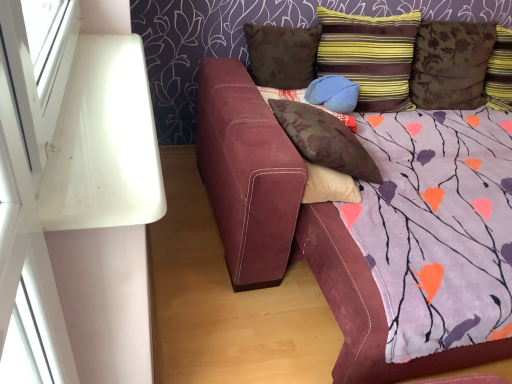
The width and height of the screenshot is (512, 384). Identify the location of striped velvet pillow at upper right, marked as the 4th pillow in a left-to-right arrangement. (370, 56).

At what (x,y) coordinates should I click in order to perform the action: click on suede couch at center. Please return your answer as a coordinate pair (x, y). Looking at the image, I should click on (295, 227).

Describe the element at coordinates (324, 140) in the screenshot. I see `brown suede pillow at center, acting as the fourth pillow starting from the right` at that location.

At what (x,y) coordinates should I click in order to perform the action: click on striped velvet pillow at upper right, placed as the 2th pillow when sorted from right to left. Please return your answer as a coordinate pair (x, y). Image resolution: width=512 pixels, height=384 pixels. Looking at the image, I should click on (370, 56).

Who is shorter, brown suede pillow at center, which ranks as the second pillow in left-to-right order, or striped velvet pillow at upper right, marked as the 4th pillow in a left-to-right arrangement?

With less height is brown suede pillow at center, which ranks as the second pillow in left-to-right order.

Which object is wider, brown suede pillow at center, which ranks as the second pillow in left-to-right order, or striped velvet pillow at upper right, marked as the 4th pillow in a left-to-right arrangement?

brown suede pillow at center, which ranks as the second pillow in left-to-right order.

Would you consider brown suede pillow at center, acting as the fourth pillow starting from the right, to be distant from striped velvet pillow at upper right, placed as the 2th pillow when sorted from right to left?

brown suede pillow at center, acting as the fourth pillow starting from the right, is near striped velvet pillow at upper right, placed as the 2th pillow when sorted from right to left, not far away.

From the image's perspective, relative to striped velvet pillow at upper right, placed as the 2th pillow when sorted from right to left, is brown suede pillow at center, acting as the fourth pillow starting from the right, above or below?

brown suede pillow at center, acting as the fourth pillow starting from the right, is below striped velvet pillow at upper right, placed as the 2th pillow when sorted from right to left.

I want to click on the 2nd pillow behind the brown suede pillow at center, which ranks as the second pillow in left-to-right order, so click(x=333, y=93).

Does blue suede pillow at upper center, which ranks as the third pillow in left-to-right order, have a greater width compared to brown suede pillow at center, acting as the fourth pillow starting from the right?

Incorrect, the width of blue suede pillow at upper center, which ranks as the third pillow in left-to-right order, does not surpass that of brown suede pillow at center, acting as the fourth pillow starting from the right.

Measure the distance from blue suede pillow at upper center, which ranks as the 3th pillow in right-to-left order, to brown suede pillow at center, acting as the fourth pillow starting from the right.

blue suede pillow at upper center, which ranks as the 3th pillow in right-to-left order, and brown suede pillow at center, acting as the fourth pillow starting from the right, are 16.33 inches apart.

What's the angular difference between blue suede pillow at upper center, which ranks as the 3th pillow in right-to-left order, and brown suede pillow at center, acting as the fourth pillow starting from the right,'s facing directions?

The facing directions of blue suede pillow at upper center, which ranks as the 3th pillow in right-to-left order, and brown suede pillow at center, acting as the fourth pillow starting from the right, are 0.000286 degrees apart.

Is suede couch at center in contact with brown suede pillow at center, which ranks as the second pillow in left-to-right order?

No, suede couch at center is not next to brown suede pillow at center, which ranks as the second pillow in left-to-right order.

From a real-world perspective, is suede couch at center below brown suede pillow at center, acting as the fourth pillow starting from the right?

Yes, from a real-world perspective, suede couch at center is beneath brown suede pillow at center, acting as the fourth pillow starting from the right.

Considering the sizes of suede couch at center and brown suede pillow at center, which ranks as the second pillow in left-to-right order, in the image, is suede couch at center wider or thinner than brown suede pillow at center, which ranks as the second pillow in left-to-right order,?

Result: In the image, suede couch at center appears to be wider than brown suede pillow at center, which ranks as the second pillow in left-to-right order.

From the image's perspective, between suede couch at center and brown suede pillow at center, which ranks as the second pillow in left-to-right order, which one is located above?

From the image's view, brown suede pillow at center, which ranks as the second pillow in left-to-right order, is above.

Is striped velvet pillow at upper right, marked as the 4th pillow in a left-to-right arrangement, aimed at floral fabric pillow at upper right, acting as the 5th pillow starting from the left?

No, striped velvet pillow at upper right, marked as the 4th pillow in a left-to-right arrangement, does not turn towards floral fabric pillow at upper right, acting as the 5th pillow starting from the left.

From the image's perspective, is striped velvet pillow at upper right, marked as the 4th pillow in a left-to-right arrangement, under floral fabric pillow at upper right, the first pillow viewed from the right?

Correct, striped velvet pillow at upper right, marked as the 4th pillow in a left-to-right arrangement, appears lower than floral fabric pillow at upper right, the first pillow viewed from the right, in the image.

Consider the image. Who is taller, striped velvet pillow at upper right, marked as the 4th pillow in a left-to-right arrangement, or floral fabric pillow at upper right, the first pillow viewed from the right?

striped velvet pillow at upper right, marked as the 4th pillow in a left-to-right arrangement.

Which is in front, striped velvet pillow at upper right, placed as the 2th pillow when sorted from right to left, or floral fabric pillow at upper right, the first pillow viewed from the right?

Positioned in front is striped velvet pillow at upper right, placed as the 2th pillow when sorted from right to left.

Would you say suede couch at center is a long distance from floral fabric pillow at upper right, the first pillow viewed from the right?

Yes, suede couch at center and floral fabric pillow at upper right, the first pillow viewed from the right, are located far from each other.

Who is smaller, suede couch at center or floral fabric pillow at upper right, acting as the 5th pillow starting from the left?

Smaller between the two is floral fabric pillow at upper right, acting as the 5th pillow starting from the left.

From a real-world perspective, between suede couch at center and floral fabric pillow at upper right, acting as the 5th pillow starting from the left, who is vertically higher?

floral fabric pillow at upper right, acting as the 5th pillow starting from the left, is physically above.

Does suede couch at center have a lesser width compared to floral fabric pillow at upper right, the first pillow viewed from the right?

No, suede couch at center is not thinner than floral fabric pillow at upper right, the first pillow viewed from the right.

Is point (398, 76) closer to camera compared to point (261, 190)?

That is False.

Starting from the suede couch at center, which pillow is the 3rd one to the right? Please provide its 2D coordinates.

[(370, 56)]

From the picture: Is striped velvet pillow at upper right, marked as the 4th pillow in a left-to-right arrangement, shorter than suede couch at center?

No.

Is striped velvet pillow at upper right, marked as the 4th pillow in a left-to-right arrangement, to the right of suede couch at center from the viewer's perspective?

Yes.

In terms of width, does striped velvet pillow at upper right, placed as the 2th pillow when sorted from right to left, look wider or thinner when compared to brown suede pillow at upper center, the 1th pillow viewed from the left?

Considering their sizes, striped velvet pillow at upper right, placed as the 2th pillow when sorted from right to left, looks broader than brown suede pillow at upper center, the 1th pillow viewed from the left.

At what (x,y) coordinates should I click in order to perform the action: click on pillow above the brown suede pillow at upper center, the 5th pillow viewed from the right (from a real-world perspective). Please return your answer as a coordinate pair (x, y). This screenshot has width=512, height=384. Looking at the image, I should click on (x=370, y=56).

From a real-world perspective, between striped velvet pillow at upper right, placed as the 2th pillow when sorted from right to left, and brown suede pillow at upper center, the 5th pillow viewed from the right, who is vertically higher?

striped velvet pillow at upper right, placed as the 2th pillow when sorted from right to left, is physically above.

Which is behind, striped velvet pillow at upper right, marked as the 4th pillow in a left-to-right arrangement, or brown suede pillow at upper center, the 5th pillow viewed from the right?

brown suede pillow at upper center, the 5th pillow viewed from the right, is further from the camera.

There is a brown suede pillow at center, which ranks as the second pillow in left-to-right order. Identify the location of the 4th pillow above it (from a real-world perspective). (370, 56).

I want to click on the 2nd pillow behind the brown suede pillow at center, which ranks as the second pillow in left-to-right order, starting your count from the anchor, so click(x=333, y=93).

Based on their spatial positions, is brown suede pillow at center, which ranks as the second pillow in left-to-right order, or brown suede pillow at upper center, the 5th pillow viewed from the right, further from suede couch at center?

brown suede pillow at upper center, the 5th pillow viewed from the right, is further to suede couch at center.

Considering their positions, is brown suede pillow at center, which ranks as the second pillow in left-to-right order, positioned further to brown suede pillow at upper center, the 5th pillow viewed from the right, than floral fabric pillow at upper right, the first pillow viewed from the right?

floral fabric pillow at upper right, the first pillow viewed from the right, is further to brown suede pillow at upper center, the 5th pillow viewed from the right.

When comparing their distances from blue suede pillow at upper center, which ranks as the third pillow in left-to-right order, does suede couch at center or floral fabric pillow at upper right, acting as the 5th pillow starting from the left, seem closer?

suede couch at center lies closer to blue suede pillow at upper center, which ranks as the third pillow in left-to-right order, than the other object.

Consider the image. Which object lies nearer to the anchor point suede couch at center, brown suede pillow at center, which ranks as the second pillow in left-to-right order, or blue suede pillow at upper center, which ranks as the third pillow in left-to-right order?

brown suede pillow at center, which ranks as the second pillow in left-to-right order, lies closer to suede couch at center than the other object.

Estimate the real-world distances between objects in this image. Which object is closer to suede couch at center, floral fabric pillow at upper right, acting as the 5th pillow starting from the left, or brown suede pillow at center, which ranks as the second pillow in left-to-right order?

brown suede pillow at center, which ranks as the second pillow in left-to-right order.

Looking at the image, which one is located further to striped velvet pillow at upper right, placed as the 2th pillow when sorted from right to left, brown suede pillow at center, acting as the fourth pillow starting from the right, or blue suede pillow at upper center, which ranks as the third pillow in left-to-right order?

brown suede pillow at center, acting as the fourth pillow starting from the right.

Based on their spatial positions, is brown suede pillow at upper center, the 5th pillow viewed from the right, or suede couch at center further from floral fabric pillow at upper right, acting as the 5th pillow starting from the left?

The object further to floral fabric pillow at upper right, acting as the 5th pillow starting from the left, is suede couch at center.

Which object lies further to the anchor point brown suede pillow at center, acting as the fourth pillow starting from the right, brown suede pillow at upper center, the 1th pillow viewed from the left, or striped velvet pillow at upper right, marked as the 4th pillow in a left-to-right arrangement?

Based on the image, striped velvet pillow at upper right, marked as the 4th pillow in a left-to-right arrangement, appears to be further to brown suede pillow at center, acting as the fourth pillow starting from the right.

Image resolution: width=512 pixels, height=384 pixels. I want to click on studio couch situated between brown suede pillow at upper center, the 5th pillow viewed from the right, and floral fabric pillow at upper right, acting as the 5th pillow starting from the left, from left to right, so 295,227.

What are the coordinates of `pillow situated between blue suede pillow at upper center, which ranks as the third pillow in left-to-right order, and floral fabric pillow at upper right, the first pillow viewed from the right, from left to right` in the screenshot? It's located at (370, 56).

This screenshot has width=512, height=384. I want to click on pillow between striped velvet pillow at upper right, marked as the 4th pillow in a left-to-right arrangement, and brown suede pillow at center, acting as the fourth pillow starting from the right, in the vertical direction, so click(333, 93).